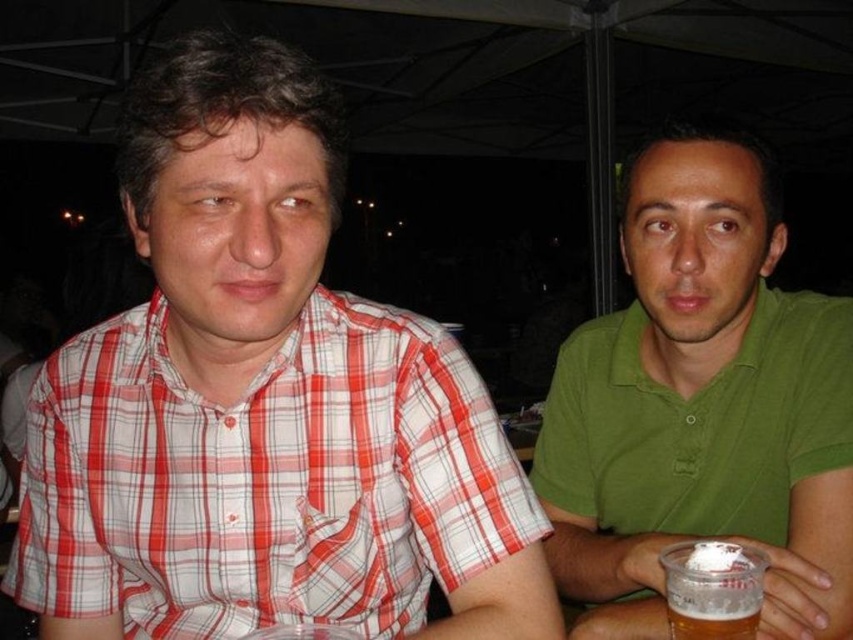
Measure the distance from red plaid shirt at left to green matte shirt at center.

A distance of 13.74 inches exists between red plaid shirt at left and green matte shirt at center.

Is point (451, 560) positioned in front of point (532, 484)?

Yes, point (451, 560) is closer to viewer.

Locate an element on the screen. red plaid shirt at left is located at coordinates (265, 481).

Which of these two, green matte shirt at center or translucent plastic cup at lower right, stands taller?

With more height is green matte shirt at center.

Is green matte shirt at center to the left of translucent plastic cup at lower right from the viewer's perspective?

Incorrect, green matte shirt at center is not on the left side of translucent plastic cup at lower right.

I want to click on green matte shirt at center, so click(x=701, y=403).

Between point (219, 449) and point (679, 618), which one is positioned behind?

Point (219, 449)

Is red plaid shirt at left behind translucent plastic cup at lower right?

Yes, red plaid shirt at left is further from the viewer.

Does point (134, 554) come closer to viewer compared to point (737, 611)?

No, (134, 554) is behind (737, 611).

Where is `red plaid shirt at left`? red plaid shirt at left is located at coordinates point(265,481).